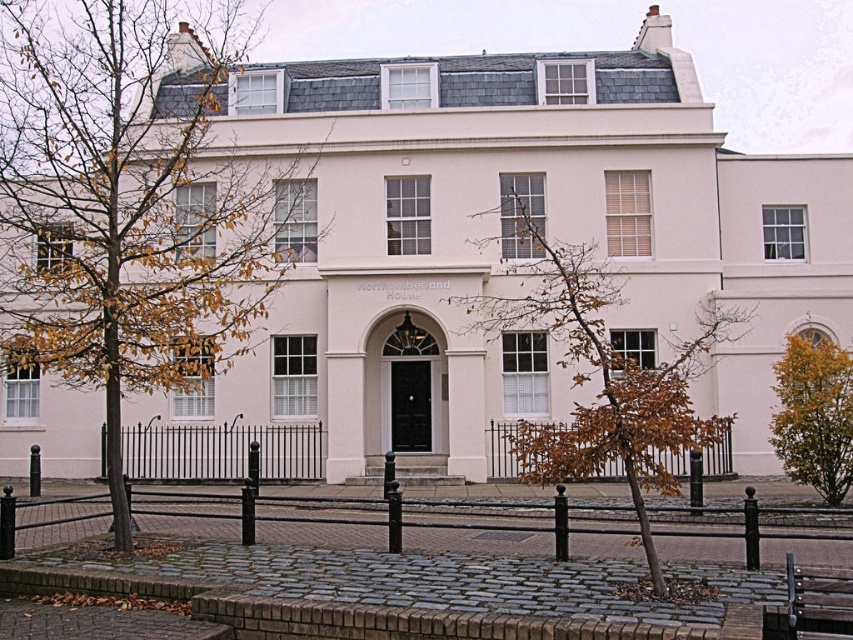
Who is higher up, brown leafy tree at left or metallic silver bench at lower right?

Positioned higher is brown leafy tree at left.

Can you confirm if brown leafy tree at left is shorter than metallic silver bench at lower right?

No.

Is point (283, 252) positioned behind point (786, 628)?

That is True.

You are a GUI agent. You are given a task and a screenshot of the screen. Output one action in this format:
    pyautogui.click(x=<x>, y=<y>)
    Task: Click on the brown leafy tree at left
    The width and height of the screenshot is (853, 640).
    Given the screenshot: What is the action you would take?
    pyautogui.click(x=128, y=204)

In the scene shown: Is brown leafy tree at center closer to camera compared to black wrought iron fence at lower center?

Yes, brown leafy tree at center is in front of black wrought iron fence at lower center.

Can you confirm if brown leafy tree at center is smaller than black wrought iron fence at lower center?

No.

In order to click on brown leafy tree at center in this screenshot , I will do `click(602, 376)`.

Does yellow-green foliage at right lie in front of black wrought iron fence at center?

No.

Image resolution: width=853 pixels, height=640 pixels. Describe the element at coordinates (814, 413) in the screenshot. I see `yellow-green foliage at right` at that location.

This screenshot has width=853, height=640. I want to click on yellow-green foliage at right, so click(x=814, y=413).